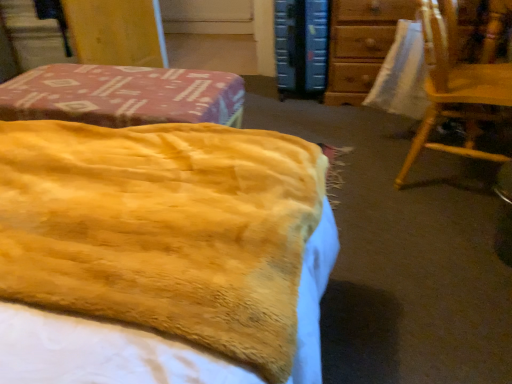
Where is `wooden chair at right`? wooden chair at right is located at coordinates (455, 86).

Identify the location of blue hardcover book at upper center. (301, 46).

From the image's perspective, does wooden chair at right appear lower than blue hardcover book at upper center?

Yes.

Considering their positions, is wooden chair at right located in front of or behind blue hardcover book at upper center?

wooden chair at right is in front of blue hardcover book at upper center.

Would you say wooden chair at right is a long distance from blue hardcover book at upper center?

No, there isn't a large distance between wooden chair at right and blue hardcover book at upper center.

Is wooden chair at right at the left side of blue hardcover book at upper center?

In fact, wooden chair at right is to the right of blue hardcover book at upper center.

From a real-world perspective, is yellow plush blanket at center above or below wooden chair at right?

Clearly, from a real-world perspective, yellow plush blanket at center is above wooden chair at right.

From the image's perspective, is yellow plush blanket at center above or below wooden chair at right?

Based on their image positions, yellow plush blanket at center is located beneath wooden chair at right.

Is yellow plush blanket at center with wooden chair at right?

No, yellow plush blanket at center is not in contact with wooden chair at right.

Does yellow plush blanket at center have a larger size compared to wooden chair at right?

No.

Where is `bed located above the blue hardcover book at upper center (from a real-world perspective)`? This screenshot has width=512, height=384. bed located above the blue hardcover book at upper center (from a real-world perspective) is located at coordinates (163, 229).

Considering the sizes of objects yellow plush blanket at center and blue hardcover book at upper center in the image provided, who is smaller, yellow plush blanket at center or blue hardcover book at upper center?

yellow plush blanket at center.

Considering the sizes of objects yellow plush blanket at center and blue hardcover book at upper center in the image provided, who is taller, yellow plush blanket at center or blue hardcover book at upper center?

blue hardcover book at upper center.

From the image's perspective, is yellow plush blanket at center below blue hardcover book at upper center?

Correct, yellow plush blanket at center appears lower than blue hardcover book at upper center in the image.

Are yellow plush blanket at center and wooden chair at upper right located far from each other?

Yes, yellow plush blanket at center is far from wooden chair at upper right.

Which point is more distant from viewer, [245,353] or [352,87]?

Positioned behind is point [352,87].

Which object is positioned more to the right, yellow plush blanket at center or wooden chair at upper right?

wooden chair at upper right is more to the right.

Is wooden chair at right at the back of blue hardcover book at upper center?

No, blue hardcover book at upper center's orientation is not away from wooden chair at right.

Which object is positioned more to the left, blue hardcover book at upper center or wooden chair at right?

Positioned to the left is blue hardcover book at upper center.

How different are the orientations of blue hardcover book at upper center and wooden chair at right in degrees?

blue hardcover book at upper center and wooden chair at right are facing 79.5 degrees away from each other.

At what (x,y) coordinates should I click in order to perform the action: click on chair to the right of blue hardcover book at upper center. Please return your answer as a coordinate pair (x, y). Looking at the image, I should click on (455, 86).

Does blue hardcover book at upper center have a greater width compared to wooden chair at upper right?

No.

Who is taller, blue hardcover book at upper center or wooden chair at upper right?

With more height is blue hardcover book at upper center.

Which is behind, point (291, 65) or point (377, 49)?

The point (291, 65) is behind.

Would you say blue hardcover book at upper center is inside or outside wooden chair at upper right?

blue hardcover book at upper center exists outside the volume of wooden chair at upper right.

Is blue hardcover book at upper center oriented towards yellow plush blanket at center?

Yes, blue hardcover book at upper center is facing yellow plush blanket at center.

From a real-world perspective, which is physically below, blue hardcover book at upper center or yellow plush blanket at center?

blue hardcover book at upper center.

Relative to yellow plush blanket at center, is blue hardcover book at upper center in front or behind?

blue hardcover book at upper center is positioned farther from the viewer than yellow plush blanket at center.

Based on the photo, how many degrees apart are the facing directions of blue hardcover book at upper center and yellow plush blanket at center?

180 degrees.

At what (x,y) coordinates should I click in order to perform the action: click on chair in front of the blue hardcover book at upper center. Please return your answer as a coordinate pair (x, y). The width and height of the screenshot is (512, 384). Looking at the image, I should click on (455, 86).

At what (x,y) coordinates should I click in order to perform the action: click on chair on the right side of yellow plush blanket at center. Please return your answer as a coordinate pair (x, y). Looking at the image, I should click on (455, 86).

When comparing their distances from blue hardcover book at upper center, does wooden chair at right or wooden chair at upper right seem closer?

The object closer to blue hardcover book at upper center is wooden chair at upper right.

Based on the photo, based on their spatial positions, is wooden chair at right or wooden chair at upper right closer to yellow plush blanket at center?

wooden chair at right is closer to yellow plush blanket at center.

Based on their spatial positions, is wooden chair at upper right or wooden chair at right further from yellow plush blanket at center?

Among the two, wooden chair at upper right is located further to yellow plush blanket at center.

Estimate the real-world distances between objects in this image. Which object is further from yellow plush blanket at center, blue hardcover book at upper center or wooden chair at right?

The object further to yellow plush blanket at center is blue hardcover book at upper center.

Looking at the image, which one is located further to wooden chair at upper right, yellow plush blanket at center or wooden chair at right?

Among the two, yellow plush blanket at center is located further to wooden chair at upper right.

Based on their spatial positions, is blue hardcover book at upper center or wooden chair at upper right further from yellow plush blanket at center?

Among the two, blue hardcover book at upper center is located further to yellow plush blanket at center.

Which object lies further to the anchor point blue hardcover book at upper center, yellow plush blanket at center or wooden chair at upper right?

yellow plush blanket at center is positioned further to the anchor blue hardcover book at upper center.

Estimate the real-world distances between objects in this image. Which object is closer to wooden chair at right, yellow plush blanket at center or wooden chair at upper right?

wooden chair at upper right.

Identify the location of chair between yellow plush blanket at center and blue hardcover book at upper center along the z-axis. The height and width of the screenshot is (384, 512). (455, 86).

The height and width of the screenshot is (384, 512). In order to click on furniture between wooden chair at right and blue hardcover book at upper center from front to back in this screenshot , I will do `click(360, 45)`.

The width and height of the screenshot is (512, 384). In order to click on furniture between yellow plush blanket at center and blue hardcover book at upper center along the z-axis in this screenshot , I will do point(360,45).

I want to click on chair located between yellow plush blanket at center and wooden chair at upper right in the depth direction, so [455, 86].